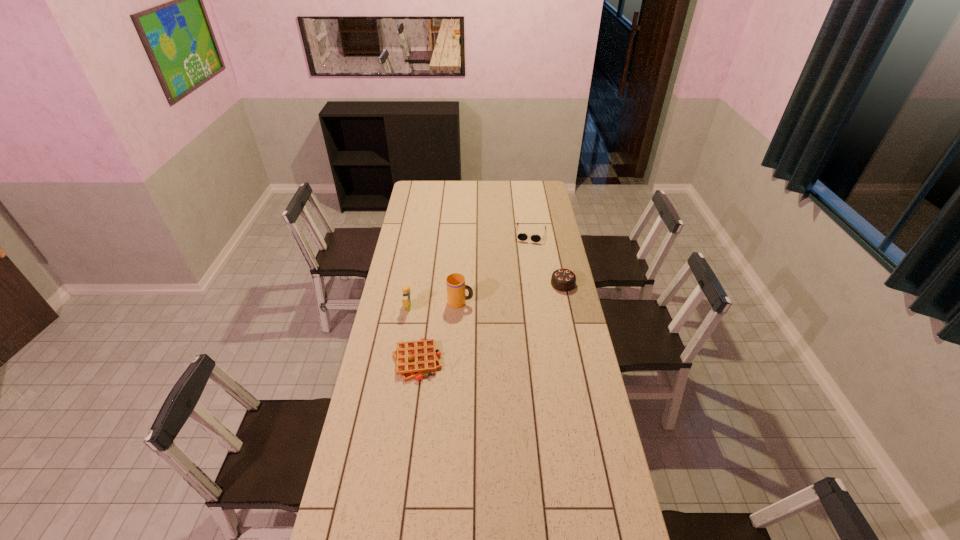
Locate an element on the screen. waffle positioned at the left edge is located at coordinates 413,359.

At what (x,y) coordinates should I click in order to perform the action: click on Lego that is at the left edge. Please return your answer as a coordinate pair (x, y). Looking at the image, I should click on pyautogui.click(x=406, y=300).

I want to click on chocolate cake located in the right edge section of the desktop, so click(x=563, y=280).

Identify the location of sunglasses situated at the right edge. Image resolution: width=960 pixels, height=540 pixels. (521, 236).

The image size is (960, 540). Find the location of `free spot at the far edge of the desktop`. free spot at the far edge of the desktop is located at coordinates (464, 189).

You are a GUI agent. You are given a task and a screenshot of the screen. Output one action in this format:
    pyautogui.click(x=<x>, y=<y>)
    Task: Click on the free location at the left edge
    
    Given the screenshot: What is the action you would take?
    pyautogui.click(x=391, y=451)

The image size is (960, 540). I want to click on vacant region at the right edge of the desktop, so click(547, 322).

Where is `vacant area at the far right corner`? The height and width of the screenshot is (540, 960). vacant area at the far right corner is located at coordinates (526, 187).

Image resolution: width=960 pixels, height=540 pixels. In the image, there is a desktop. Find the location of `vacant space at the near right corner`. vacant space at the near right corner is located at coordinates (604, 515).

Image resolution: width=960 pixels, height=540 pixels. I want to click on free space between the tallest object and the nearest object, so click(439, 331).